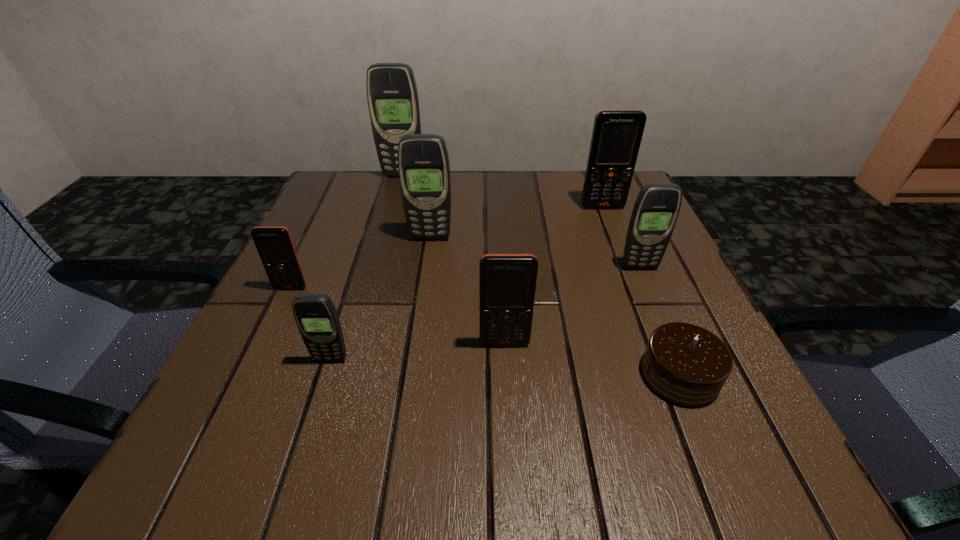
Locate an element on the screen. vacant space at the far left corner of the desktop is located at coordinates pyautogui.click(x=383, y=202).

Identify the location of vacant space at the near left corner. (212, 432).

The width and height of the screenshot is (960, 540). In order to click on free space at the far right corner of the desktop in this screenshot , I will do `click(608, 218)`.

Locate an element on the screen. This screenshot has width=960, height=540. vacant space at the near right corner of the desktop is located at coordinates (740, 442).

Identify the location of free spot between the chocolate cake and the seventh nearest object. (641, 291).

You are a GUI agent. You are given a task and a screenshot of the screen. Output one action in this format:
    pyautogui.click(x=<x>, y=<y>)
    Task: Click on the free space between the fourth object from right to left and the third nearest gray cellular telephone
    
    Given the screenshot: What is the action you would take?
    pyautogui.click(x=468, y=291)

Where is `free space between the second farthest gray cellular telephone and the chocolate cake`? Image resolution: width=960 pixels, height=540 pixels. free space between the second farthest gray cellular telephone and the chocolate cake is located at coordinates (555, 306).

Image resolution: width=960 pixels, height=540 pixels. Find the location of `free area in between the third farthest cellular telephone and the second nearest gray cellular telephone`. free area in between the third farthest cellular telephone and the second nearest gray cellular telephone is located at coordinates (535, 253).

Locate an element on the screen. The width and height of the screenshot is (960, 540). vacant region between the fourth nearest cellular telephone and the leftmost cellular telephone is located at coordinates (465, 278).

Find the location of `empty location between the nearest gray cellular telephone and the chocolate cake`. empty location between the nearest gray cellular telephone and the chocolate cake is located at coordinates (505, 367).